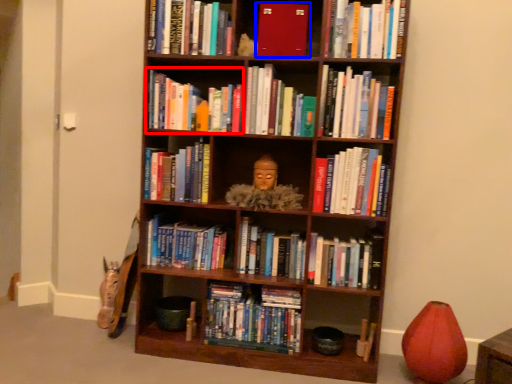
Question: Which point is closer to the camera, book (highlighted by a red box) or book (highlighted by a blue box)?

Choices:
 (A) book
 (B) book

Answer: (B)